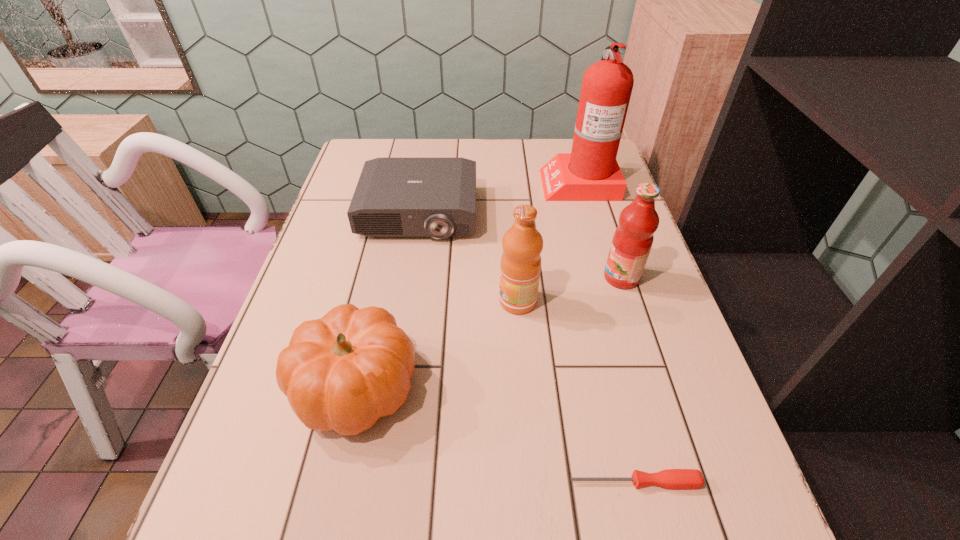
Where is `free region located on the front-facing side of the tallest object`? This screenshot has width=960, height=540. free region located on the front-facing side of the tallest object is located at coordinates (476, 182).

Where is `vacant space situated on the label side of the fourth object from right to left`? Image resolution: width=960 pixels, height=540 pixels. vacant space situated on the label side of the fourth object from right to left is located at coordinates (379, 301).

The width and height of the screenshot is (960, 540). What are the coordinates of `vacant area located 0.340m on the label side of the fourth object from right to left` in the screenshot? It's located at (348, 301).

I want to click on free region located 0.220m on the label side of the fourth object from right to left, so click(401, 301).

At what (x,y) coordinates should I click in order to perform the action: click on vacant space located on the front label of the right fruit juice. Please return your answer as a coordinate pair (x, y). The image size is (960, 540). Looking at the image, I should click on (549, 278).

This screenshot has width=960, height=540. Identify the location of free space located on the front label of the right fruit juice. (537, 278).

Image resolution: width=960 pixels, height=540 pixels. In order to click on free space located 0.050m on the front label of the right fruit juice in this screenshot , I will do `click(583, 278)`.

Identify the location of vacant space located on the back of the fifth farthest object. The image size is (960, 540). (393, 225).

This screenshot has width=960, height=540. I want to click on vacant space located 0.190m on the front-facing side of the projector, so click(x=406, y=298).

Where is `vacant space located 0.400m at the tip of the nearest object`? Image resolution: width=960 pixels, height=540 pixels. vacant space located 0.400m at the tip of the nearest object is located at coordinates (324, 482).